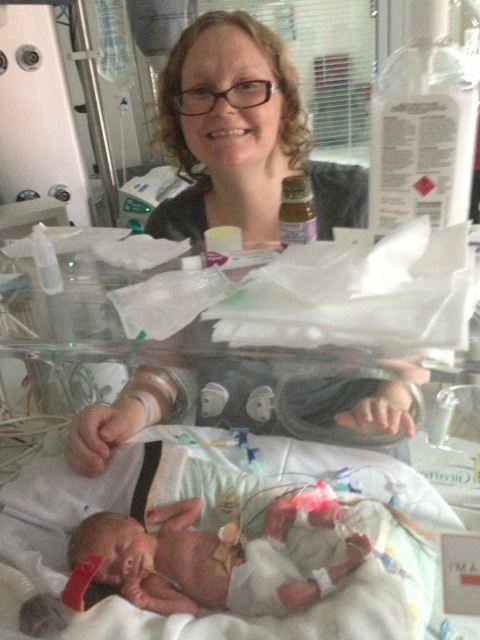
Which of these two, matte black hair at upper center or smooth skin newborn at lower left, stands shorter?

smooth skin newborn at lower left

Between point (368, 420) and point (212, 589), which one is positioned behind?

The point (368, 420) is more distant.

Locate an element on the screen. matte black hair at upper center is located at coordinates (241, 134).

The height and width of the screenshot is (640, 480). Find the location of `matte black hair at upper center`. matte black hair at upper center is located at coordinates (241, 134).